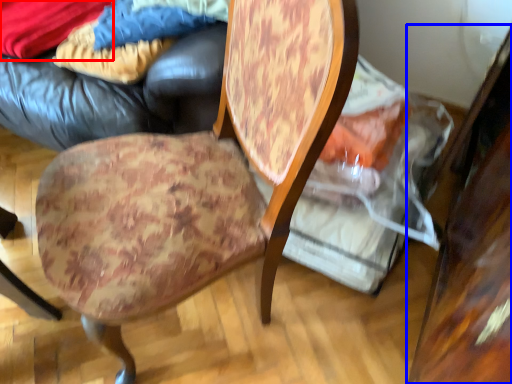
Question: Which point is closer to the camera, fabric (highlighted by a red box) or table (highlighted by a blue box)?

Choices:
 (A) fabric
 (B) table

Answer: (B)